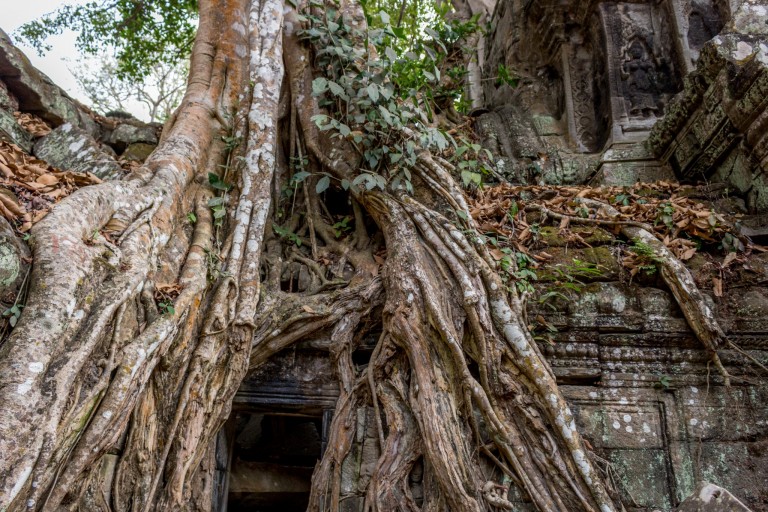
The width and height of the screenshot is (768, 512). Identify the location of hole in the wall. (275, 453).